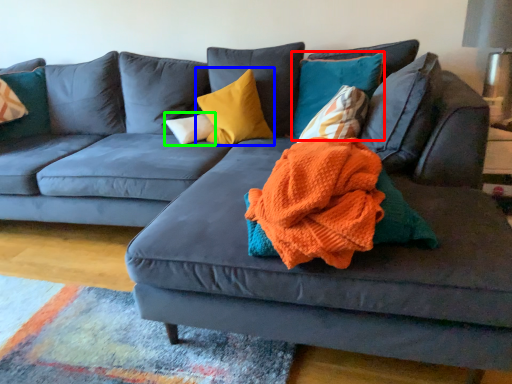
Question: Which is nearer to the pillow (highlighted by a red box)? pillow (highlighted by a blue box) or pillow (highlighted by a green box).

Choices:
 (A) pillow
 (B) pillow

Answer: (A)